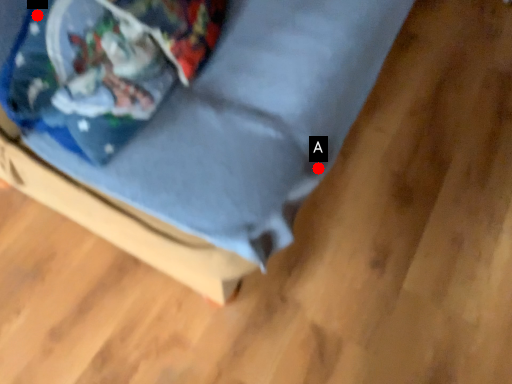
Question: Two points are circled on the image, labeled by A and B beside each circle. Which of the following is the closest to the observer?

Choices:
 (A) A is closer
 (B) B is closer

Answer: (B)